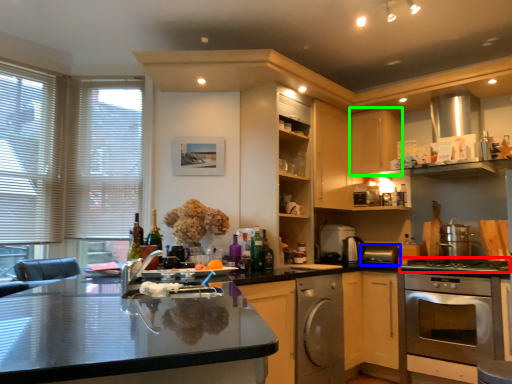
Question: Considering the real-world distances, which object is closest to gas stove (highlighted by a red box)? appliance (highlighted by a blue box) or cabinetry (highlighted by a green box).

Choices:
 (A) appliance
 (B) cabinetry

Answer: (A)